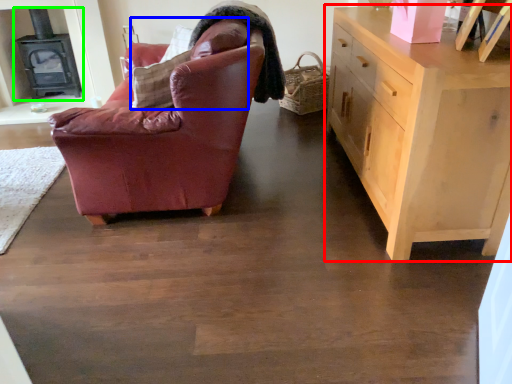
Question: Considering the real-world distances, which object is farthest from chest of drawers (highlighted by a red box)? pillow (highlighted by a blue box) or fireplace (highlighted by a green box)?

Choices:
 (A) pillow
 (B) fireplace

Answer: (B)